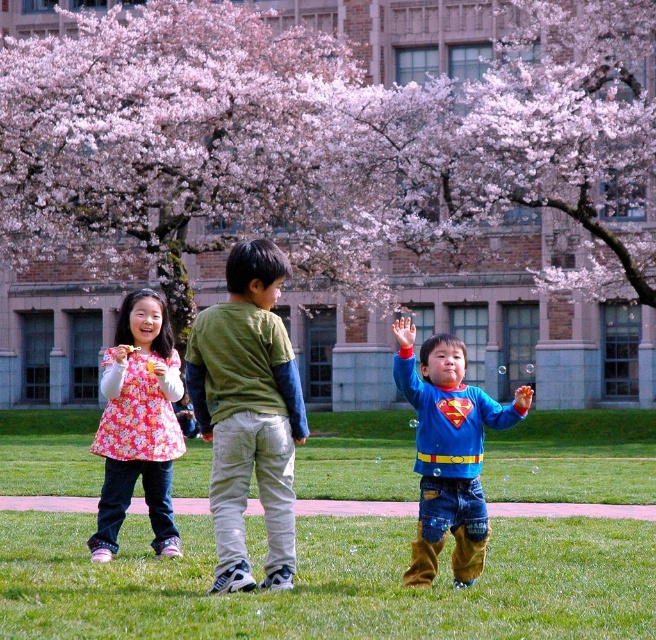
Question: Can you confirm if green grass at center is thinner than green cotton shirt at center?

Choices:
 (A) yes
 (B) no

Answer: (B)

Question: Which of the following is the farthest from the observer?

Choices:
 (A) (478, 20)
 (B) (445, 348)
 (C) (169, 534)
 (D) (216, 509)

Answer: (A)

Question: Among these points, which one is farthest from the camera?

Choices:
 (A) (148, 417)
 (B) (173, 109)
 (C) (268, 390)

Answer: (B)

Question: Is green grass at center thinner than floral fabric dress at left?

Choices:
 (A) no
 (B) yes

Answer: (A)

Question: Which object appears farthest from the camera in this image?

Choices:
 (A) green cotton shirt at center
 (B) blue cotton shirt at center

Answer: (A)

Question: Is green grass at center above blue cotton shirt at center?

Choices:
 (A) yes
 (B) no

Answer: (B)